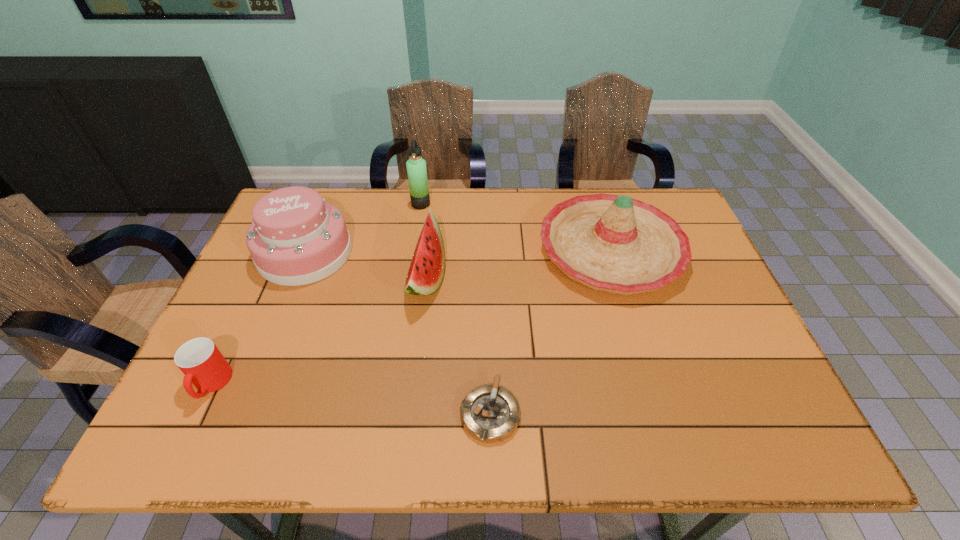
I want to click on vacant space in between the tallest object and the shortest object, so click(x=455, y=308).

Locate an element on the screen. The height and width of the screenshot is (540, 960). unoccupied position between the tallest object and the rightmost object is located at coordinates [516, 227].

Identify the location of vacant point located between the fourth tallest object and the cake. This screenshot has width=960, height=540. (366, 266).

Locate an element on the screen. Image resolution: width=960 pixels, height=540 pixels. free space between the rightmost object and the thermos bottle is located at coordinates (x=516, y=227).

You are a GUI agent. You are given a task and a screenshot of the screen. Output one action in this format:
    pyautogui.click(x=<x>, y=<y>)
    Task: Click on the vacant area between the cake and the third shortest object
    This screenshot has width=960, height=540.
    Given the screenshot: What is the action you would take?
    pyautogui.click(x=366, y=266)

Locate an element on the screen. unoccupied position between the second shortest object and the third shortest object is located at coordinates (319, 332).

Identify which object is the fourth nearest to the cake. Please provide its 2D coordinates. Your answer should be formatted as a tuple, i.e. [(x, y)], where the tuple contains the x and y coordinates of a point satisfying the conditions above.

[(490, 413)]

This screenshot has height=540, width=960. I want to click on object identified as the fourth closest to the sombrero, so click(x=296, y=238).

Where is `vacant area in the image that satisfies the following two spatial constraints: 1. on the outer rind of the watermelon; 2. on the right side of the shortest object`? Image resolution: width=960 pixels, height=540 pixels. vacant area in the image that satisfies the following two spatial constraints: 1. on the outer rind of the watermelon; 2. on the right side of the shortest object is located at coordinates (410, 413).

Where is `blank space that satisfies the following two spatial constraints: 1. on the front side of the rightmost object; 2. on the right side of the tallest object`? The height and width of the screenshot is (540, 960). blank space that satisfies the following two spatial constraints: 1. on the front side of the rightmost object; 2. on the right side of the tallest object is located at coordinates (414, 250).